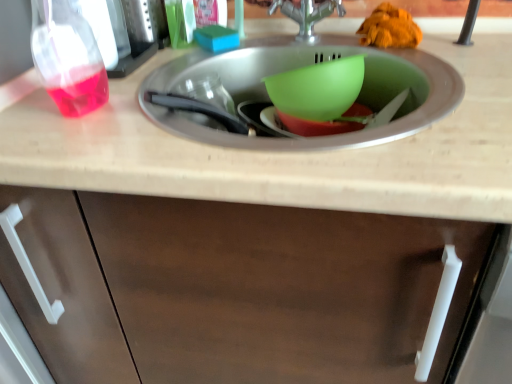
Where is `vacant area that lies in front of orange fuzzy sponge at upper right, which is the 2th food from left to right`? The image size is (512, 384). vacant area that lies in front of orange fuzzy sponge at upper right, which is the 2th food from left to right is located at coordinates [x=409, y=65].